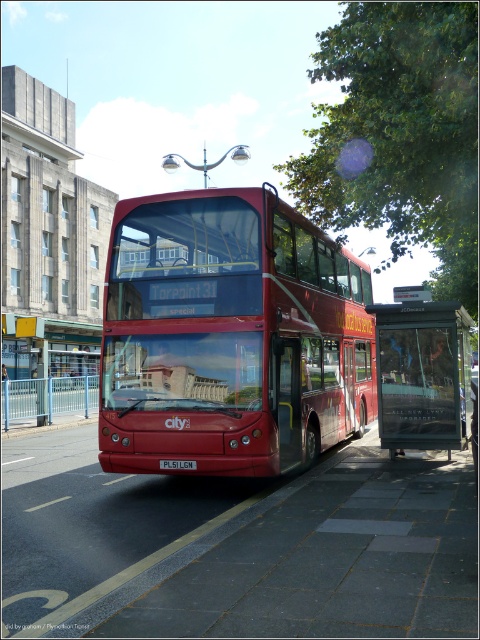
Does shiny red bus at center appear under red plastic license plate at center?

Actually, shiny red bus at center is above red plastic license plate at center.

Is shiny red bus at center closer to the viewer compared to red plastic license plate at center?

Yes.

Does point (109, 460) come farther from viewer compared to point (172, 461)?

Yes.

At what (x,y) coordinates should I click in order to perform the action: click on shiny red bus at center. Please return your answer as a coordinate pair (x, y). The width and height of the screenshot is (480, 640). Looking at the image, I should click on (229, 336).

Is point (467, 436) farther from viewer compared to point (183, 467)?

Yes, point (467, 436) is farther from viewer.

Does metallic bus stop at center have a lesser width compared to red plastic license plate at center?

No.

What do you see at coordinates (422, 374) in the screenshot? I see `metallic bus stop at center` at bounding box center [422, 374].

Image resolution: width=480 pixels, height=640 pixels. I want to click on metallic bus stop at center, so click(x=422, y=374).

Is shiny red bus at center behind metallic bus stop at center?

No.

From the picture: Between shiny red bus at center and metallic bus stop at center, which one is positioned higher?

shiny red bus at center is above.

The height and width of the screenshot is (640, 480). I want to click on shiny red bus at center, so coord(229,336).